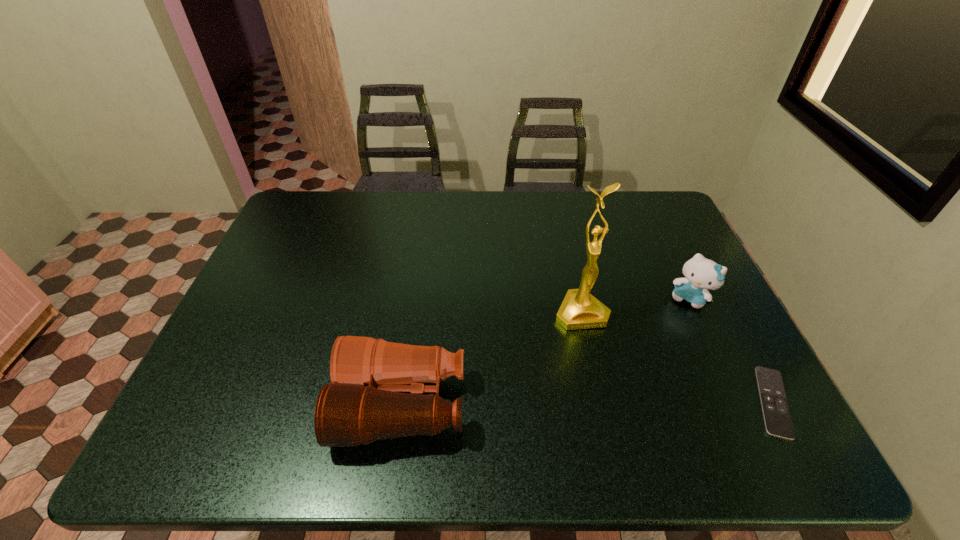
The width and height of the screenshot is (960, 540). I want to click on binoculars, so click(364, 403).

Image resolution: width=960 pixels, height=540 pixels. In order to click on remote control in this screenshot , I will do `click(777, 419)`.

Where is `the tallest object`? Image resolution: width=960 pixels, height=540 pixels. the tallest object is located at coordinates tap(579, 310).

Identify the location of the second object from left to right. The width and height of the screenshot is (960, 540). (579, 310).

At what (x,y) coordinates should I click in order to perform the action: click on kitten. Please return your answer as a coordinate pair (x, y). The width and height of the screenshot is (960, 540). Looking at the image, I should click on (701, 274).

This screenshot has height=540, width=960. Identify the location of vacant point located 0.210m through the lenses of the leftmost object. (247, 404).

Identify the location of vacant region located 0.060m through the lenses of the leftmost object. The height and width of the screenshot is (540, 960). (313, 404).

In order to click on free space located 0.090m through the lenses of the leftmost object in this screenshot , I will do `click(300, 404)`.

Image resolution: width=960 pixels, height=540 pixels. Find the location of `vacant area located on the back of the shortest object`. vacant area located on the back of the shortest object is located at coordinates pyautogui.click(x=707, y=276).

Where is `free point located 0.210m on the front-facing side of the third object from right to left`? This screenshot has width=960, height=540. free point located 0.210m on the front-facing side of the third object from right to left is located at coordinates click(621, 402).